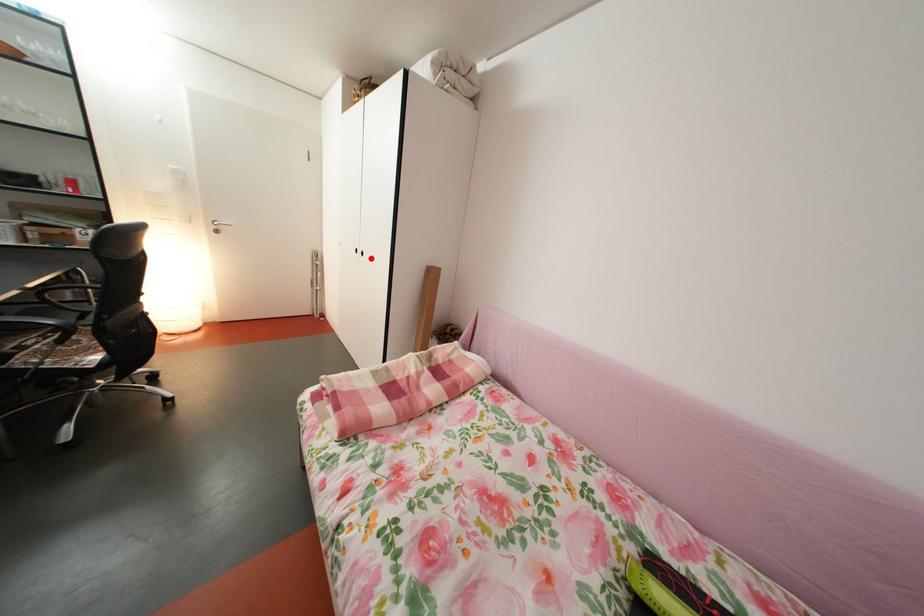
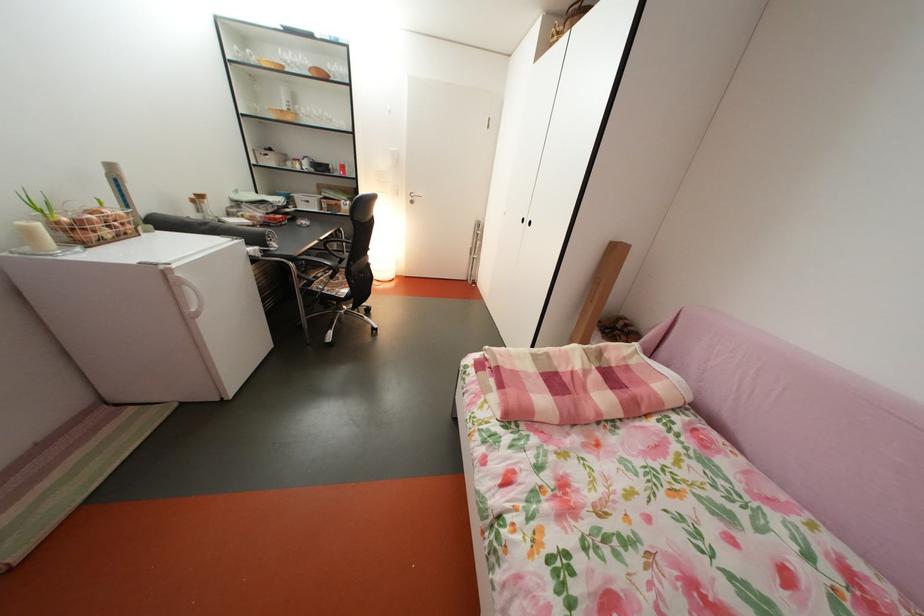
Where in the second image is the point corresponding to the highlighted location from the first image?

(538, 228)